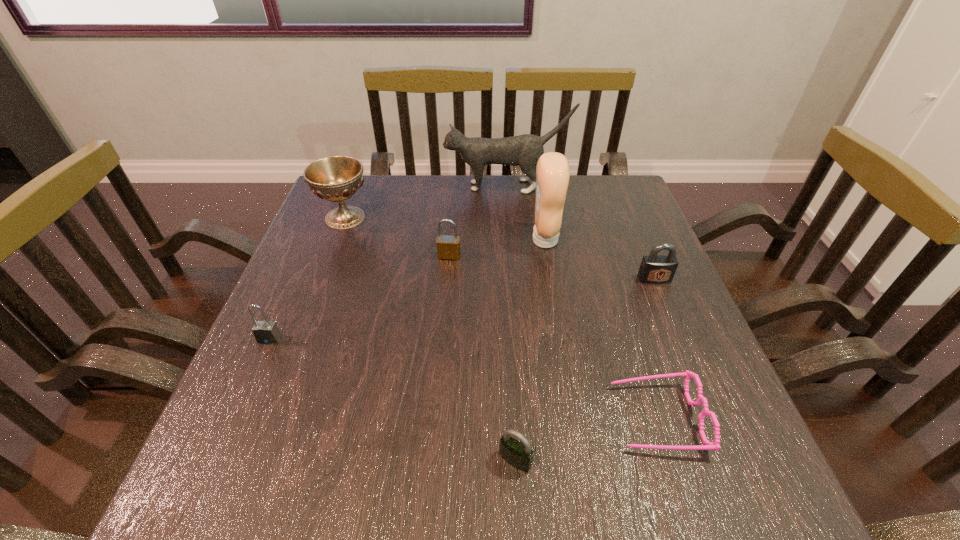
Where is `free region located 0.230m on the shackle of the leftmost padlock`? Image resolution: width=960 pixels, height=540 pixels. free region located 0.230m on the shackle of the leftmost padlock is located at coordinates [x=217, y=458].

Where is `vacant area situated 0.270m on the left of the shortest padlock`? vacant area situated 0.270m on the left of the shortest padlock is located at coordinates (330, 460).

This screenshot has width=960, height=540. I want to click on vacant point located 0.320m on the arms of the shortest object, so click(x=430, y=417).

The width and height of the screenshot is (960, 540). What are the coordinates of `vacant space located on the arms of the shortest object` in the screenshot? It's located at (535, 417).

Where is `vacant space located 0.150m on the arms of the shortest object`? vacant space located 0.150m on the arms of the shortest object is located at coordinates (529, 417).

Image resolution: width=960 pixels, height=540 pixels. Find the location of `cat present at the far edge`. cat present at the far edge is located at coordinates (524, 150).

At what (x,y) coordinates should I click in order to perform the action: click on chalice that is positioned at the far edge. Please return your answer as a coordinate pair (x, y). This screenshot has width=960, height=540. Looking at the image, I should click on (336, 178).

Locate an element on the screen. padlock that is at the near edge is located at coordinates (519, 455).

This screenshot has height=540, width=960. Identify the location of spectacles that is at the near edge. (708, 445).

Find the location of a particular element. The height and width of the screenshot is (540, 960). chalice that is at the left edge is located at coordinates (336, 178).